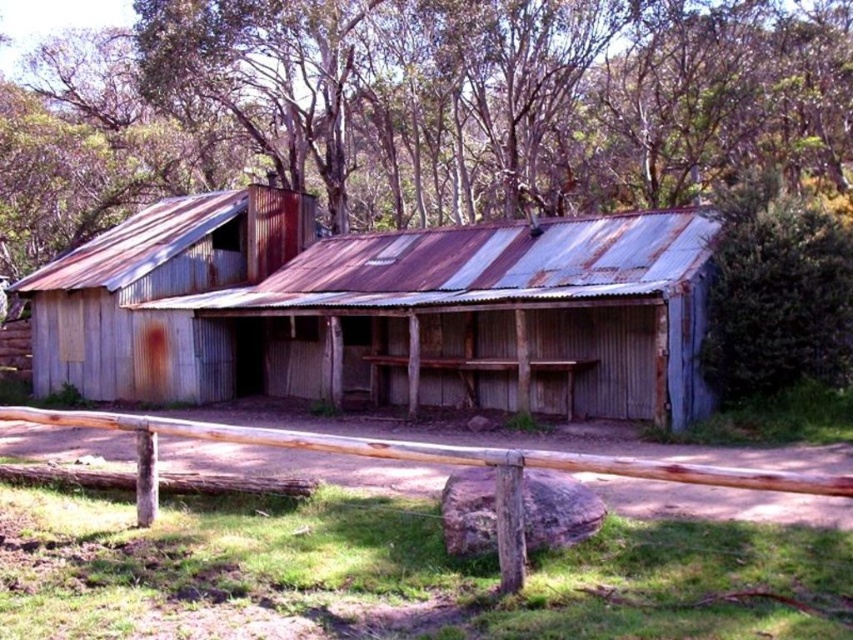
Question: Which object is farther from the camera taking this photo?

Choices:
 (A) rusty corrugated metal barn at center
 (B) rusty corrugated metal hut at center
 (C) green leafy bush at upper right
 (D) brown wooden fence at lower center

Answer: (B)

Question: Among these objects, which one is nearest to the camera?

Choices:
 (A) green leafy bush at upper right
 (B) rusty corrugated metal barn at center
 (C) brown wooden fence at lower center

Answer: (C)

Question: Does green leafy bush at upper right appear under brown wooden fence at lower center?

Choices:
 (A) yes
 (B) no

Answer: (B)

Question: Is green leafy bush at upper right positioned in front of brown wooden fence at lower center?

Choices:
 (A) yes
 (B) no

Answer: (B)

Question: Which point is closer to the camera?

Choices:
 (A) (577, 227)
 (B) (47, 356)
 (C) (444, 458)
 (D) (747, 392)

Answer: (C)

Question: Can you confirm if rusty corrugated metal barn at center is positioned above green leafy bush at upper right?

Choices:
 (A) yes
 (B) no

Answer: (B)